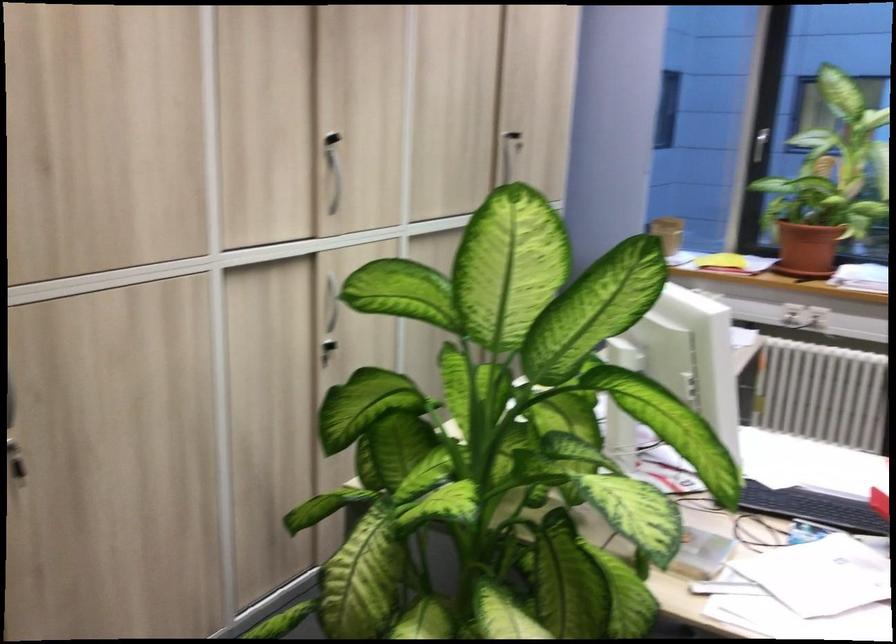
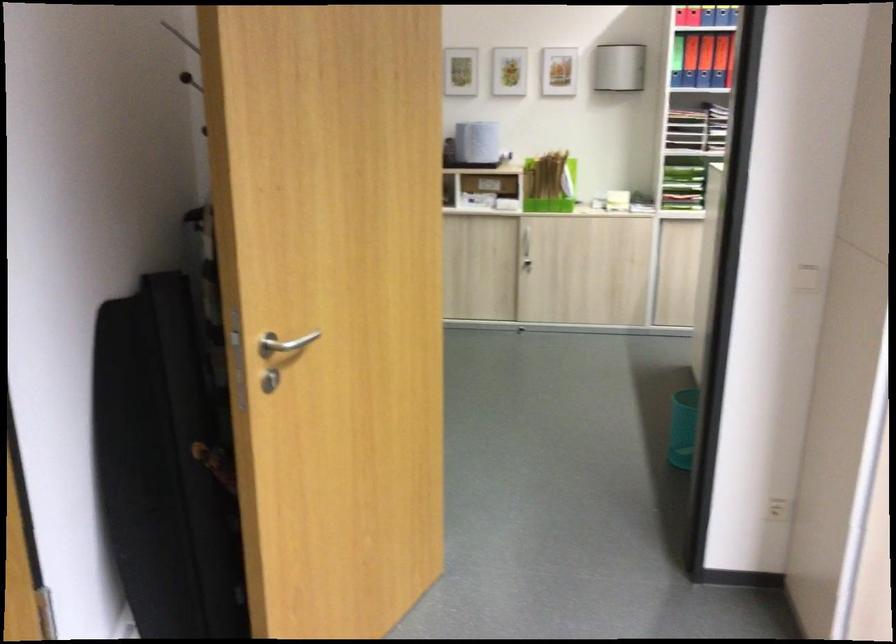
Question: The camera is either moving clockwise (left) or counter-clockwise (right) around the object. The first image is from the beginning of the video and the second image is from the end. Is the camera moving left or right when shooting the video?

Choices:
 (A) Left
 (B) Right

Answer: (B)